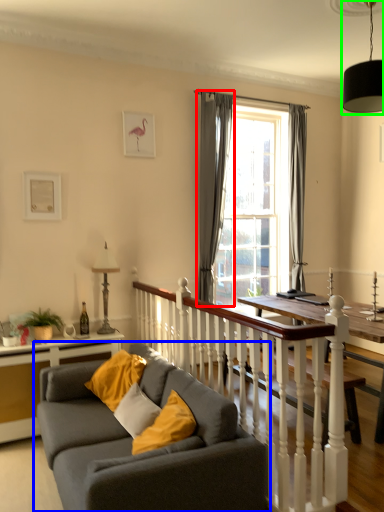
Question: Which object is the closest to the curtain (highlighted by a red box)? Choose among these: studio couch (highlighted by a blue box) or light fixture (highlighted by a green box).

Choices:
 (A) studio couch
 (B) light fixture

Answer: (B)